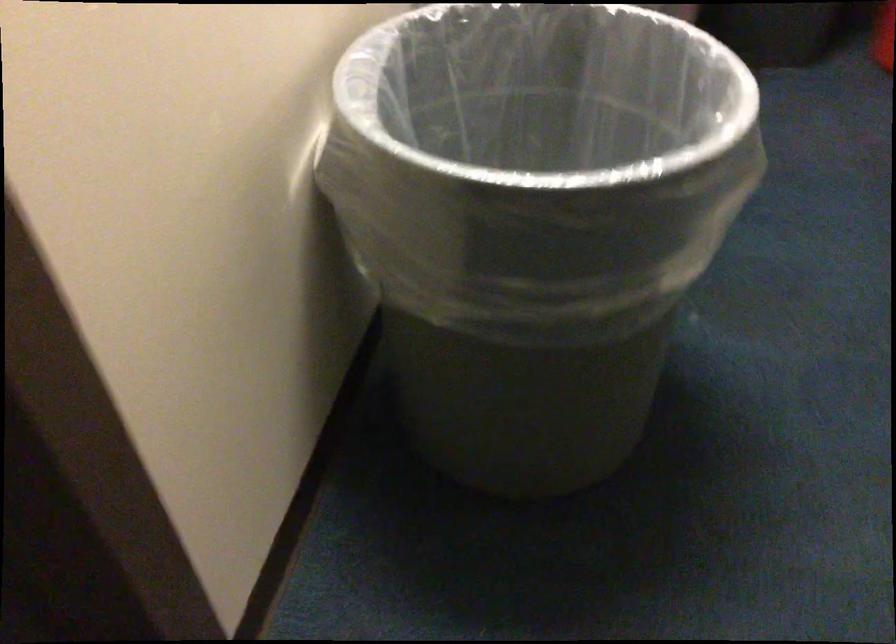
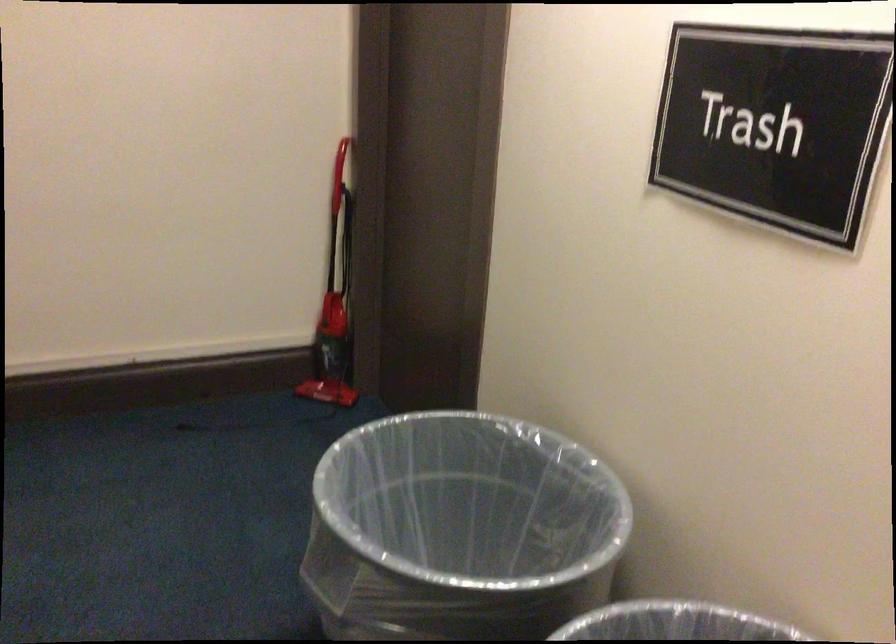
Question: I am providing you with two images of the same scene from different viewpoints. Please identify which objects are invisible in image2.

Choices:
 (A) metal trash can
 (B) small rice cooker
 (C) small trash can
 (D) red vacuum handle

Answer: (C)